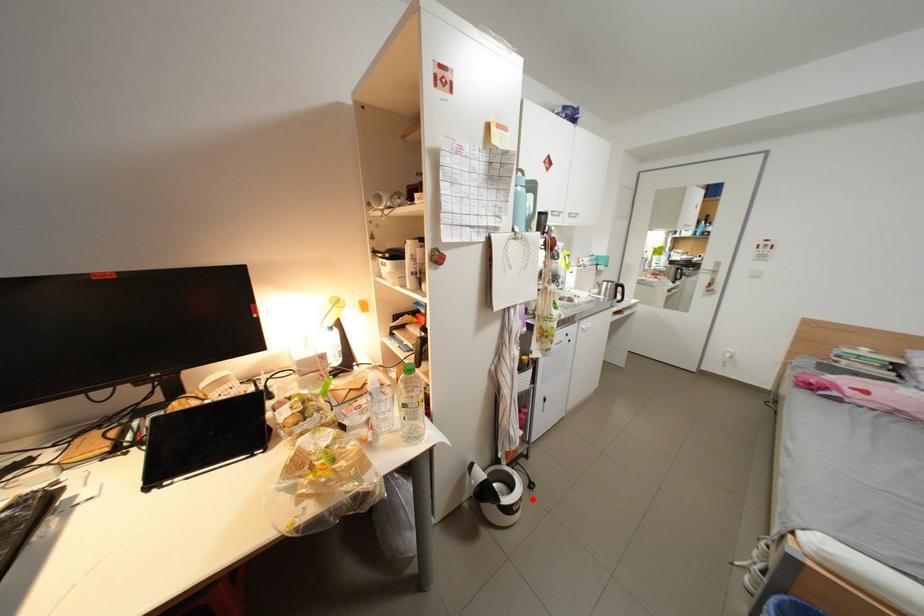
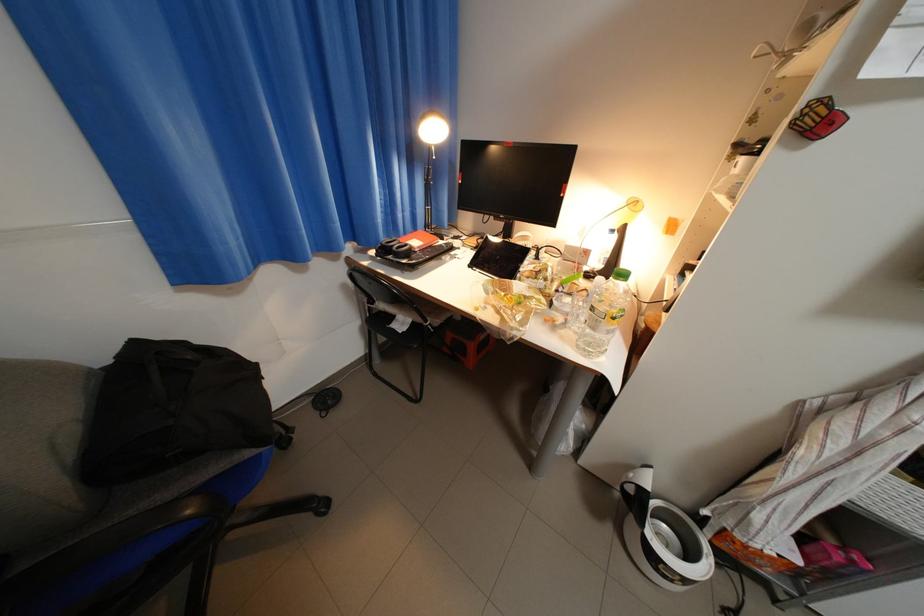
Question: I am providing you with two images of the same scene from different viewpoints. Given a red point in image1, look at the same physical point in image2. Is it:

Choices:
 (A) Closer to the viewpoint
 (B) Farther from the viewpoint

Answer: (A)